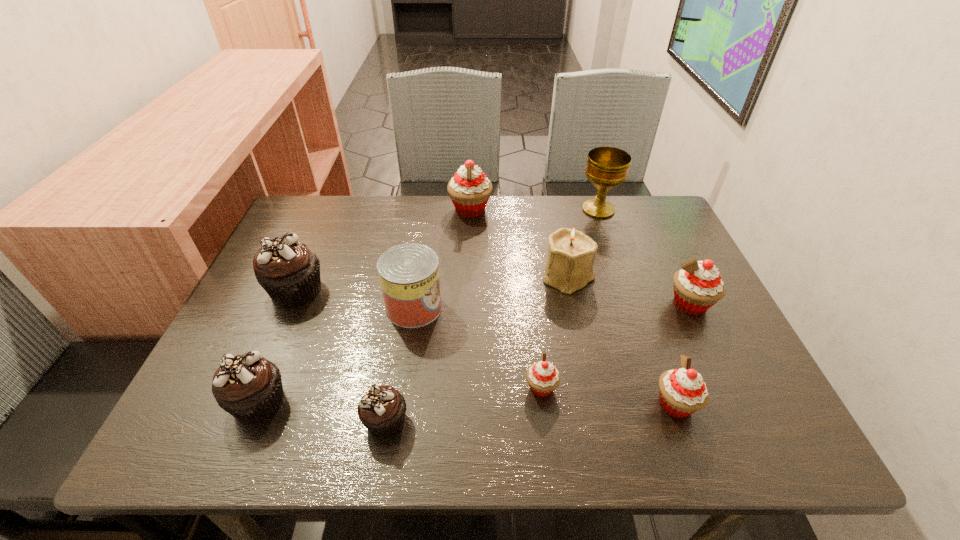
Image resolution: width=960 pixels, height=540 pixels. In order to click on vacant position located 0.090m on the back of the second farthest pink cupcake in this screenshot , I will do `click(671, 264)`.

Where is `vacant space located 0.320m on the right of the can`? This screenshot has height=540, width=960. vacant space located 0.320m on the right of the can is located at coordinates click(x=578, y=307).

Find the location of a particular element. The image size is (960, 540). free spot located 0.100m on the left of the second pink cupcake from right to left is located at coordinates (601, 404).

Image resolution: width=960 pixels, height=540 pixels. In order to click on free space located on the back of the second biggest brown cupcake in this screenshot , I will do `click(309, 279)`.

You are a GUI agent. You are given a task and a screenshot of the screen. Output one action in this format:
    pyautogui.click(x=<x>, y=<y>)
    Task: Click on the free location located 0.210m on the right of the fifth cupcake from left to right
    The width and height of the screenshot is (960, 540).
    Given the screenshot: What is the action you would take?
    pyautogui.click(x=663, y=387)

Where is `free location located 0.300m on the right of the third cupcake from left to right`? The image size is (960, 540). free location located 0.300m on the right of the third cupcake from left to right is located at coordinates (568, 420).

Locate an element on the screen. The height and width of the screenshot is (540, 960). cupcake at the far edge is located at coordinates (469, 189).

This screenshot has width=960, height=540. I want to click on chalice located at the far edge, so click(607, 167).

At what (x,y) coordinates should I click in order to perform the action: click on chalice that is at the right edge. Please return your answer as a coordinate pair (x, y). This screenshot has height=540, width=960. Looking at the image, I should click on (607, 167).

This screenshot has height=540, width=960. What are the coordinates of `object located in the near left corner section of the desktop` in the screenshot? It's located at (249, 387).